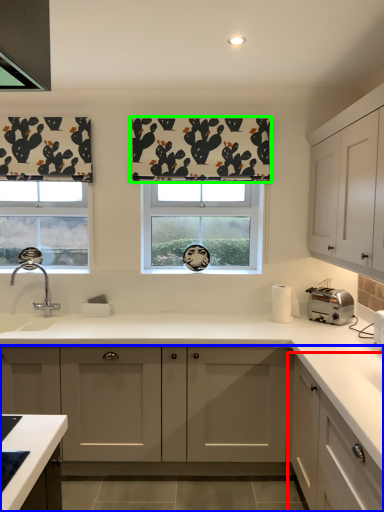
Question: Based on their relative distances, which object is farther from cabinetry (highlighted by a red box)? Choose from cabinetry (highlighted by a blue box) and curtain (highlighted by a green box).

Choices:
 (A) cabinetry
 (B) curtain

Answer: (B)